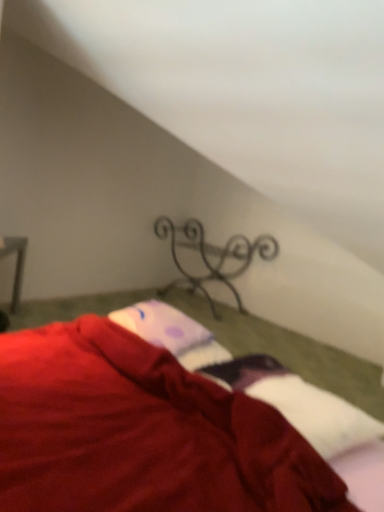
Question: Are metallic wrought iron at center and velvet red blanket at lower center beside each other?

Choices:
 (A) no
 (B) yes

Answer: (A)

Question: Is metallic wrought iron at center to the right of velvet red blanket at lower center from the viewer's perspective?

Choices:
 (A) no
 (B) yes

Answer: (B)

Question: Can you confirm if metallic wrought iron at center is shorter than velvet red blanket at lower center?

Choices:
 (A) yes
 (B) no

Answer: (B)

Question: From the image's perspective, does metallic wrought iron at center appear lower than velvet red blanket at lower center?

Choices:
 (A) no
 (B) yes

Answer: (A)

Question: Can you confirm if metallic wrought iron at center is taller than velvet red blanket at lower center?

Choices:
 (A) no
 (B) yes

Answer: (B)

Question: In terms of size, does purple dotted fabric at center appear bigger or smaller than metallic wrought iron at center?

Choices:
 (A) big
 (B) small

Answer: (B)

Question: From a real-world perspective, relative to metallic wrought iron at center, is purple dotted fabric at center vertically above or below?

Choices:
 (A) above
 (B) below

Answer: (A)

Question: Is purple dotted fabric at center to the left or to the right of metallic wrought iron at center in the image?

Choices:
 (A) left
 (B) right

Answer: (A)

Question: From the image's perspective, is purple dotted fabric at center located above or below metallic wrought iron at center?

Choices:
 (A) below
 (B) above

Answer: (A)

Question: Based on their sizes in the image, would you say purple dotted fabric at center is bigger or smaller than velvet red blanket at lower center?

Choices:
 (A) big
 (B) small

Answer: (B)

Question: Is purple dotted fabric at center spatially inside velvet red blanket at lower center, or outside of it?

Choices:
 (A) outside
 (B) inside

Answer: (B)

Question: From the image's perspective, is purple dotted fabric at center positioned above or below velvet red blanket at lower center?

Choices:
 (A) below
 (B) above

Answer: (B)

Question: In terms of height, does purple dotted fabric at center look taller or shorter compared to velvet red blanket at lower center?

Choices:
 (A) tall
 (B) short

Answer: (B)

Question: Based on their sizes in the image, would you say velvet red blanket at lower center is bigger or smaller than purple dotted fabric at center?

Choices:
 (A) small
 (B) big

Answer: (B)

Question: Is velvet red blanket at lower center taller or shorter than purple dotted fabric at center?

Choices:
 (A) short
 (B) tall

Answer: (B)